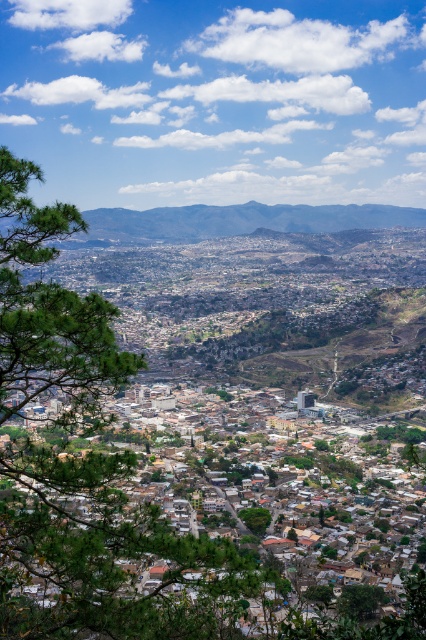
Question: Is green leafy tree at left to the right of green leafy tree at lower right from the viewer's perspective?

Choices:
 (A) yes
 (B) no

Answer: (B)

Question: Is green leafy tree at lower right to the right of green leafy tree at center from the viewer's perspective?

Choices:
 (A) no
 (B) yes

Answer: (B)

Question: Considering the real-world distances, which object is closest to the green leafy tree at center?

Choices:
 (A) green leafy tree at lower right
 (B) green leafy tree at left

Answer: (A)

Question: Is green leafy tree at left to the left of green leafy tree at center from the viewer's perspective?

Choices:
 (A) yes
 (B) no

Answer: (A)

Question: Which point is farther to the camera?

Choices:
 (A) 258,536
 (B) 23,563

Answer: (A)

Question: Considering the real-world distances, which object is closest to the green leafy tree at left?

Choices:
 (A) green leafy tree at lower right
 (B) green leafy tree at center

Answer: (B)